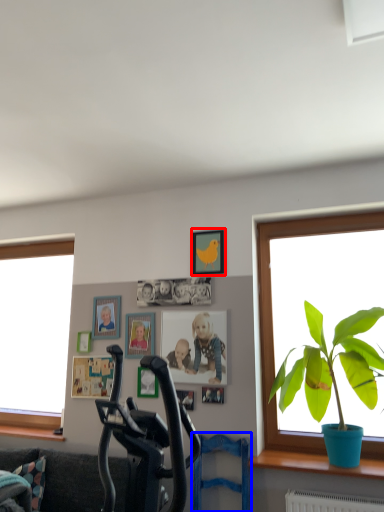
Question: Which object is closer to the camera taking this photo, picture frame (highlighted by a red box) or swivel chair (highlighted by a blue box)?

Choices:
 (A) picture frame
 (B) swivel chair

Answer: (B)